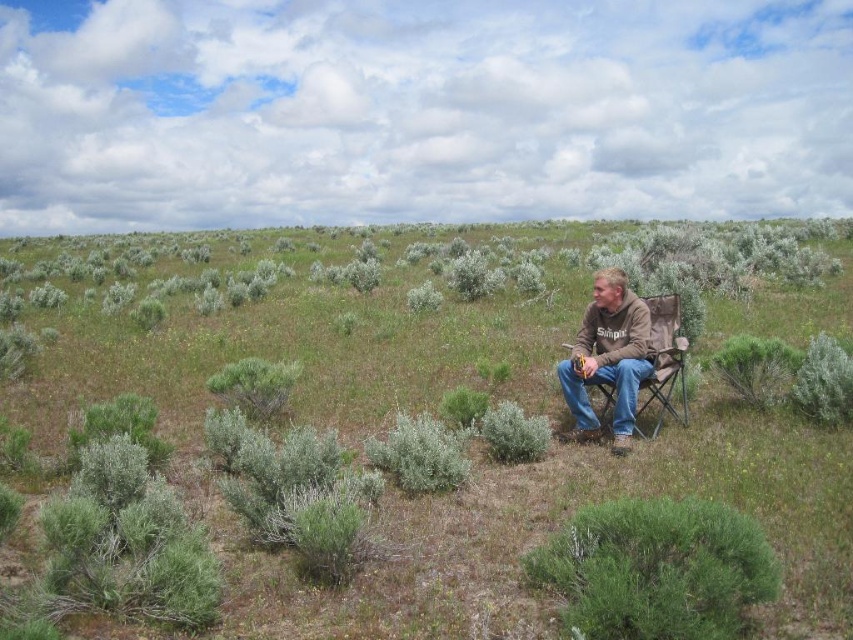
Question: Does green fuzzy bush at lower right have a larger size compared to brown cotton shirt at center?

Choices:
 (A) no
 (B) yes

Answer: (A)

Question: From the image, what is the correct spatial relationship of green fuzzy bush at lower right in relation to brown cotton shirt at center?

Choices:
 (A) right
 (B) left

Answer: (B)

Question: Considering the relative positions of green fuzzy bush at lower right and brown cotton shirt at center in the image provided, where is green fuzzy bush at lower right located with respect to brown cotton shirt at center?

Choices:
 (A) right
 (B) left

Answer: (B)

Question: Which point is closer to the camera?

Choices:
 (A) brown cotton shirt at center
 (B) green fuzzy bush at lower right

Answer: (B)

Question: Which point appears farthest from the camera in this image?

Choices:
 (A) (579, 392)
 (B) (680, 556)

Answer: (A)

Question: Which of the following is the farthest from the observer?

Choices:
 (A) (656, 548)
 (B) (625, 340)

Answer: (B)